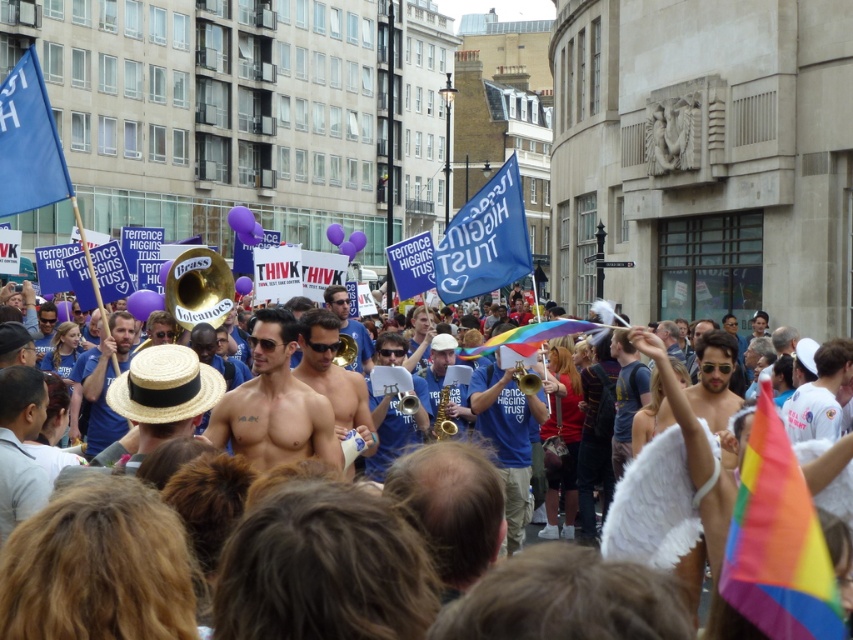
You are standing at point A at point (660, 547). You want to walk to point B which is 134.86 feet away. Is there a direct path between them?

Yes, there is a direct path between point A at point (660, 547) and point B which is 134.86 feet away.

You are a photographer trying to capture the blue fabric flag at center and the shiny skin torso at center in the same frame. Based on their positions, which object should you focus on first to ensure both are in the shot?

The blue fabric flag at center is positioned under the shiny skin torso at center, so you should focus on the shiny skin torso at center first to ensure both are in the shot.